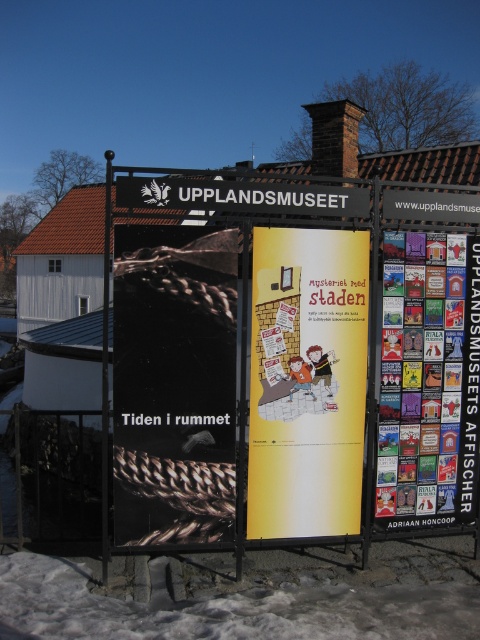
Question: Is black matte poster at center to the right of multicolored paper posters at right from the viewer's perspective?

Choices:
 (A) yes
 (B) no

Answer: (B)

Question: Is yellow paper poster at center closer to camera compared to white powdery snow at lower left?

Choices:
 (A) yes
 (B) no

Answer: (B)

Question: Which object appears closest to the camera in this image?

Choices:
 (A) white powdery snow at lower left
 (B) yellow paper poster at center

Answer: (A)

Question: Estimate the real-world distances between objects in this image. Which object is closer to the black matte poster at center?

Choices:
 (A) yellow paper poster at center
 (B) white powdery snow at lower left

Answer: (A)

Question: Is yellow paper poster at center behind white powdery snow at lower left?

Choices:
 (A) yes
 (B) no

Answer: (A)

Question: Which point appears closest to the camera in this image?

Choices:
 (A) (442, 492)
 (B) (256, 349)

Answer: (B)